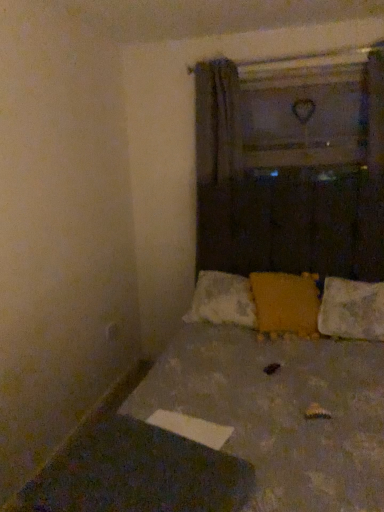
Question: Does white textured pillow at lower right, marked as the second pillow in a left-to-right arrangement, have a greater height compared to matte yellow pillow at center, which is the second pillow from right to left?

Choices:
 (A) no
 (B) yes

Answer: (A)

Question: Does white textured pillow at lower right, positioned as the first pillow in right-to-left order, appear on the right side of matte yellow pillow at center, which is the second pillow from right to left?

Choices:
 (A) no
 (B) yes

Answer: (B)

Question: Can you confirm if white textured pillow at lower right, marked as the second pillow in a left-to-right arrangement, is positioned to the left of matte yellow pillow at center, which ranks as the first pillow in left-to-right order?

Choices:
 (A) yes
 (B) no

Answer: (B)

Question: Can matte yellow pillow at center, which ranks as the first pillow in left-to-right order, be found inside white textured pillow at lower right, marked as the second pillow in a left-to-right arrangement?

Choices:
 (A) yes
 (B) no

Answer: (B)

Question: From a real-world perspective, is white textured pillow at lower right, marked as the second pillow in a left-to-right arrangement, below matte yellow pillow at center, which ranks as the first pillow in left-to-right order?

Choices:
 (A) yes
 (B) no

Answer: (A)

Question: Considering the positions of textured fabric bed at center and matte yellow pillow at center, which is the second pillow from right to left, in the image, is textured fabric bed at center wider or thinner than matte yellow pillow at center, which is the second pillow from right to left,?

Choices:
 (A) wide
 (B) thin

Answer: (A)

Question: Is textured fabric bed at center inside or outside of matte yellow pillow at center, which ranks as the first pillow in left-to-right order?

Choices:
 (A) inside
 (B) outside

Answer: (B)

Question: From a real-world perspective, is textured fabric bed at center positioned above or below matte yellow pillow at center, which is the second pillow from right to left?

Choices:
 (A) below
 (B) above

Answer: (A)

Question: Is point (370, 439) closer or farther from the camera than point (256, 274)?

Choices:
 (A) farther
 (B) closer

Answer: (B)

Question: Looking at the image, does white textured pillow at lower right, marked as the second pillow in a left-to-right arrangement, seem bigger or smaller compared to textured fabric bed at center?

Choices:
 (A) big
 (B) small

Answer: (B)

Question: From the image's perspective, is white textured pillow at lower right, marked as the second pillow in a left-to-right arrangement, positioned above or below textured fabric bed at center?

Choices:
 (A) above
 (B) below

Answer: (A)

Question: Is point click(x=337, y=336) closer or farther from the camera than point click(x=266, y=486)?

Choices:
 (A) closer
 (B) farther

Answer: (B)

Question: From a real-world perspective, relative to textured fabric bed at center, is white textured pillow at lower right, positioned as the first pillow in right-to-left order, vertically above or below?

Choices:
 (A) above
 (B) below

Answer: (B)

Question: In terms of height, does matte yellow pillow at center, which is the second pillow from right to left, look taller or shorter compared to white textured pillow at lower right, marked as the second pillow in a left-to-right arrangement?

Choices:
 (A) short
 (B) tall

Answer: (B)

Question: Considering their positions, is matte yellow pillow at center, which is the second pillow from right to left, located in front of or behind white textured pillow at lower right, positioned as the first pillow in right-to-left order?

Choices:
 (A) front
 (B) behind

Answer: (B)